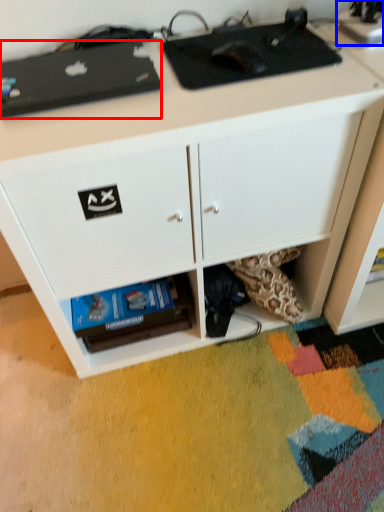
Question: Which of the following is the farthest to the observer, appliance (highlighted by a red box) or appliance (highlighted by a blue box)?

Choices:
 (A) appliance
 (B) appliance

Answer: (B)